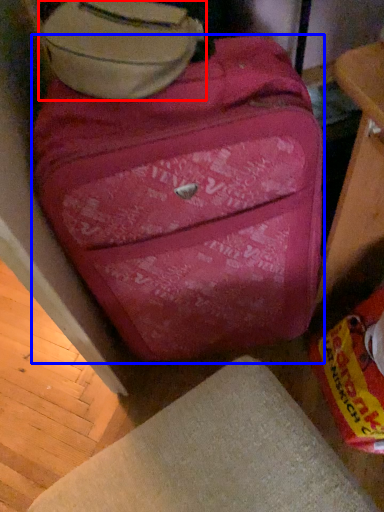
Question: Which of the following is the closest to the observer, luggage (highlighted by a red box) or suitcase (highlighted by a blue box)?

Choices:
 (A) luggage
 (B) suitcase

Answer: (B)